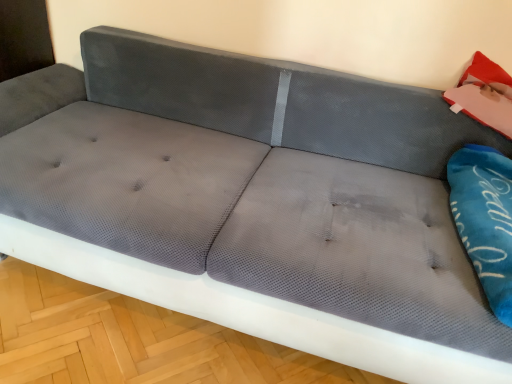
Question: Can we say matte pink cushion at upper right lies outside blue fabric pillow at right?

Choices:
 (A) yes
 (B) no

Answer: (A)

Question: Would you say matte pink cushion at upper right contains blue fabric pillow at right?

Choices:
 (A) no
 (B) yes

Answer: (A)

Question: Is matte pink cushion at upper right facing away from blue fabric pillow at right?

Choices:
 (A) yes
 (B) no

Answer: (B)

Question: Can you confirm if matte pink cushion at upper right is positioned to the right of blue fabric pillow at right?

Choices:
 (A) no
 (B) yes

Answer: (B)

Question: Are matte pink cushion at upper right and blue fabric pillow at right making contact?

Choices:
 (A) no
 (B) yes

Answer: (A)

Question: Could you tell me if matte pink cushion at upper right is facing blue fabric pillow at right?

Choices:
 (A) yes
 (B) no

Answer: (A)

Question: Is blue fabric pillow at right surrounding matte pink cushion at upper right?

Choices:
 (A) yes
 (B) no

Answer: (B)

Question: Is blue fabric pillow at right behind matte pink cushion at upper right?

Choices:
 (A) yes
 (B) no

Answer: (B)

Question: Is blue fabric pillow at right wider than matte pink cushion at upper right?

Choices:
 (A) yes
 (B) no

Answer: (A)

Question: Is blue fabric pillow at right not near matte pink cushion at upper right?

Choices:
 (A) yes
 (B) no

Answer: (B)

Question: Does blue fabric pillow at right have a lesser width compared to matte pink cushion at upper right?

Choices:
 (A) yes
 (B) no

Answer: (B)

Question: Is blue fabric pillow at right with matte pink cushion at upper right?

Choices:
 (A) no
 (B) yes

Answer: (A)

Question: Is matte pink cushion at upper right taller or shorter than blue fabric pillow at right?

Choices:
 (A) tall
 (B) short

Answer: (A)